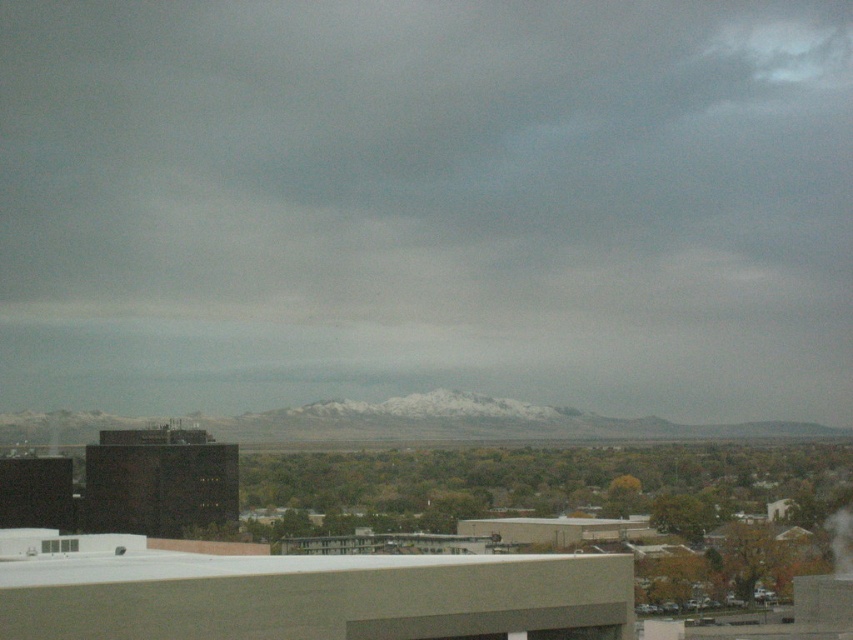
Between gray cloudy sky at upper center and white vapor at upper right, which one is positioned higher?

Positioned higher is gray cloudy sky at upper center.

How distant is gray cloudy sky at upper center from white vapor at upper right?

gray cloudy sky at upper center is 229.57 meters away from white vapor at upper right.

Who is more forward, (393, 120) or (842, 561)?

Point (842, 561)

This screenshot has width=853, height=640. I want to click on gray cloudy sky at upper center, so click(x=427, y=204).